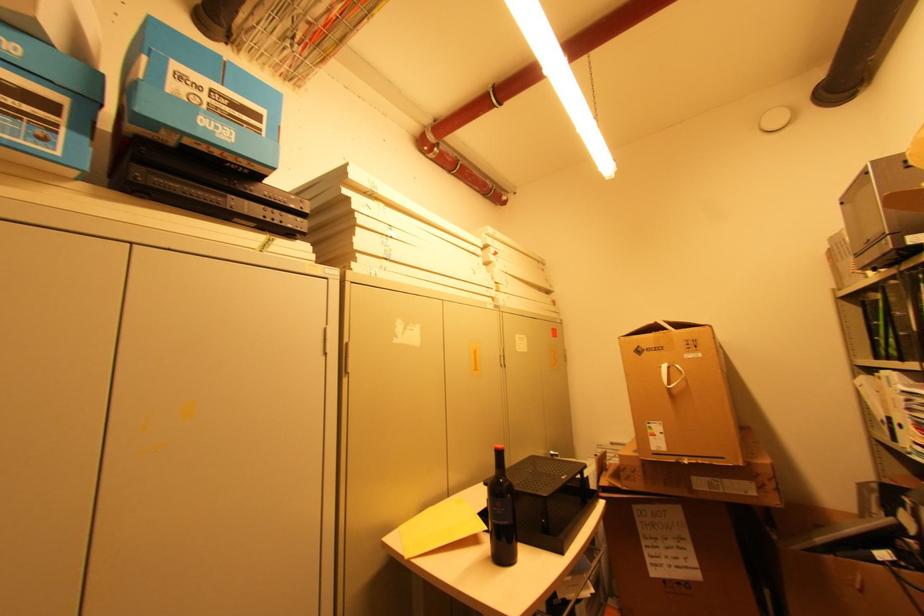
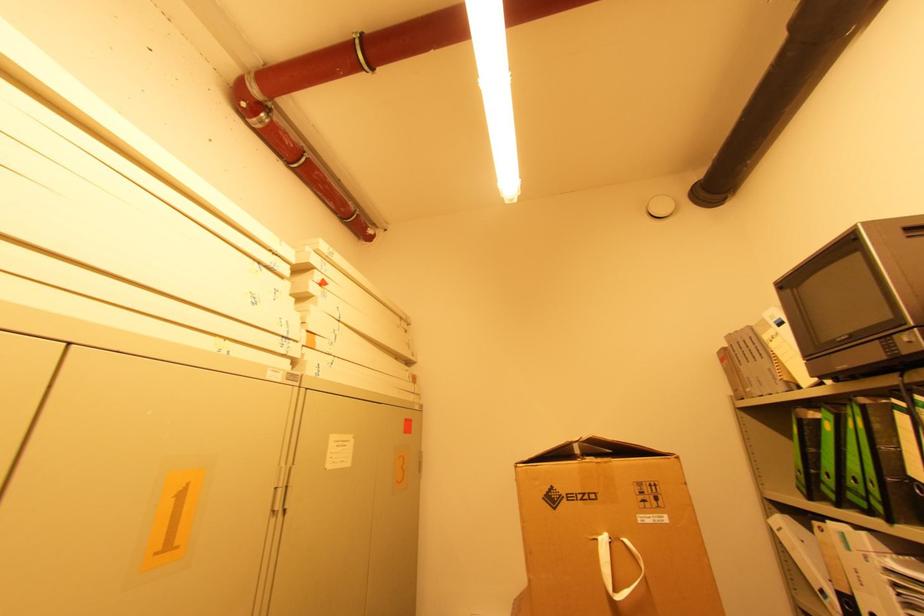
The point at [667,367] is marked in the first image. Where is the corresponding point in the second image?

(608, 541)